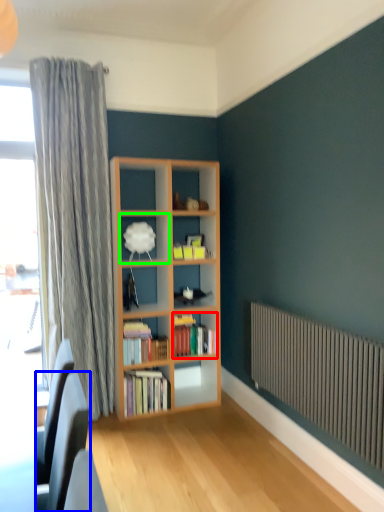
Question: Estimate the real-world distances between objects in this image. Which object is farther from book (highlighted by a red box), swivel chair (highlighted by a blue box) or shelf (highlighted by a green box)?

Choices:
 (A) swivel chair
 (B) shelf

Answer: (A)